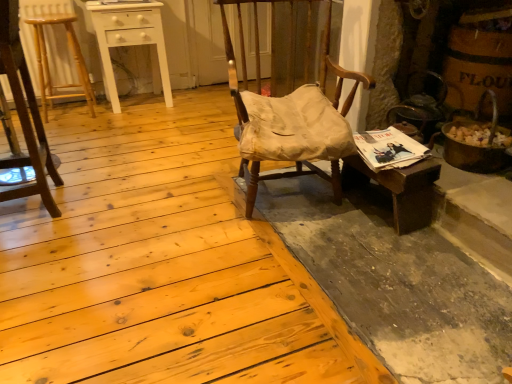
Question: Is point (377, 173) positioned closer to the camera than point (271, 0)?

Choices:
 (A) closer
 (B) farther

Answer: (A)

Question: From a real-world perspective, is wooden desk at right positioned above or below wooden chair with worn fabric cushion at center, the second chair positioned from the left?

Choices:
 (A) above
 (B) below

Answer: (B)

Question: Estimate the real-world distances between objects in this image. Which object is closer to the metallic gold swivel chair at right?

Choices:
 (A) wooden desk at right
 (B) wooden stool at left, which is the 2th chair in right-to-left order
 (C) light brown wood bar stool at left
 (D) white wood table at upper left
 (E) wooden chair with worn fabric cushion at center, the first chair in the right-to-left sequence

Answer: (A)

Question: Which object is the farthest from the white wood table at upper left?

Choices:
 (A) wooden desk at right
 (B) wooden stool at left, the first chair in the left-to-right sequence
 (C) wooden chair with worn fabric cushion at center, the second chair positioned from the left
 (D) light brown wood bar stool at left
 (E) metallic gold swivel chair at right

Answer: (A)